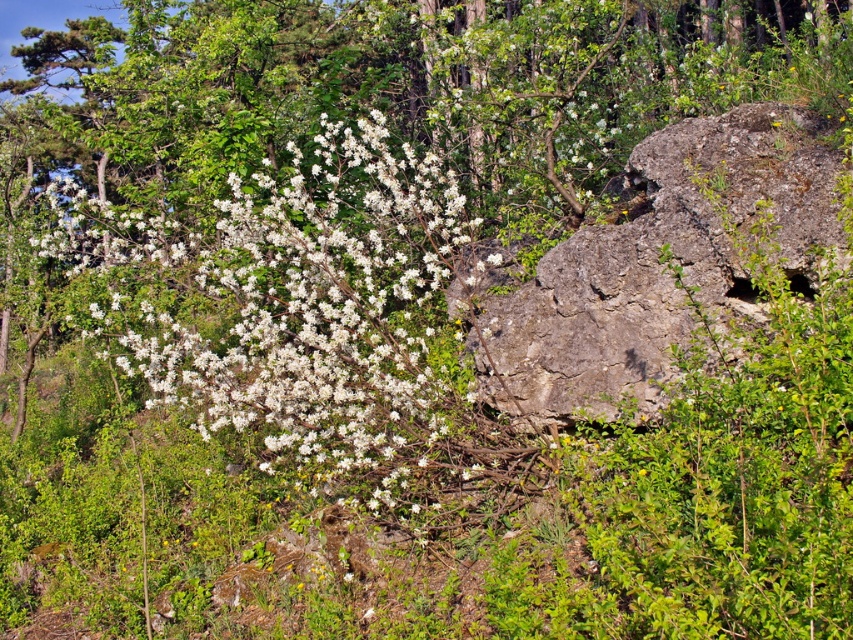
Is the position of white matte flowers at center more distant than that of gray rough rock at right?

Yes, it is.

I want to click on white matte flowers at center, so click(x=334, y=328).

Identify the location of white matte flowers at center. The image size is (853, 640). (334, 328).